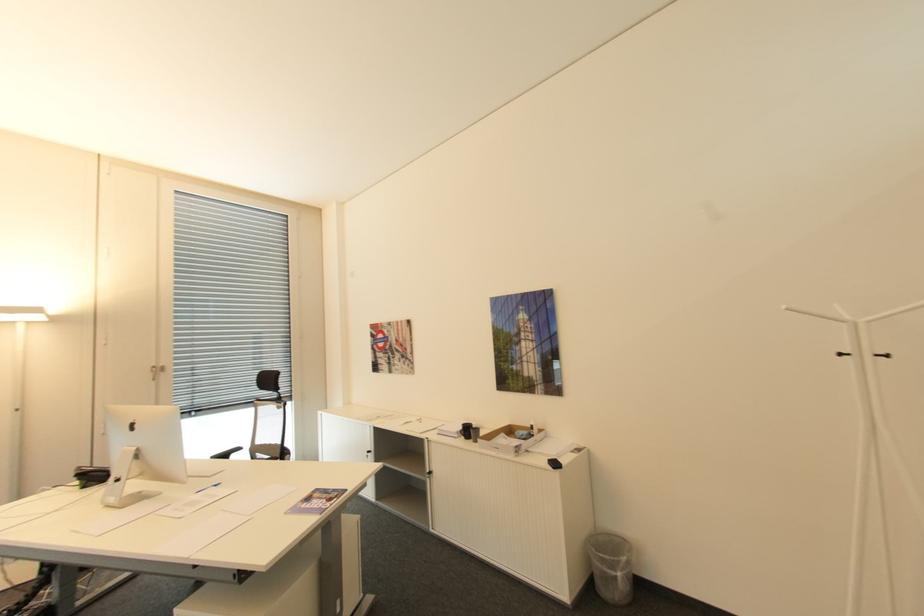
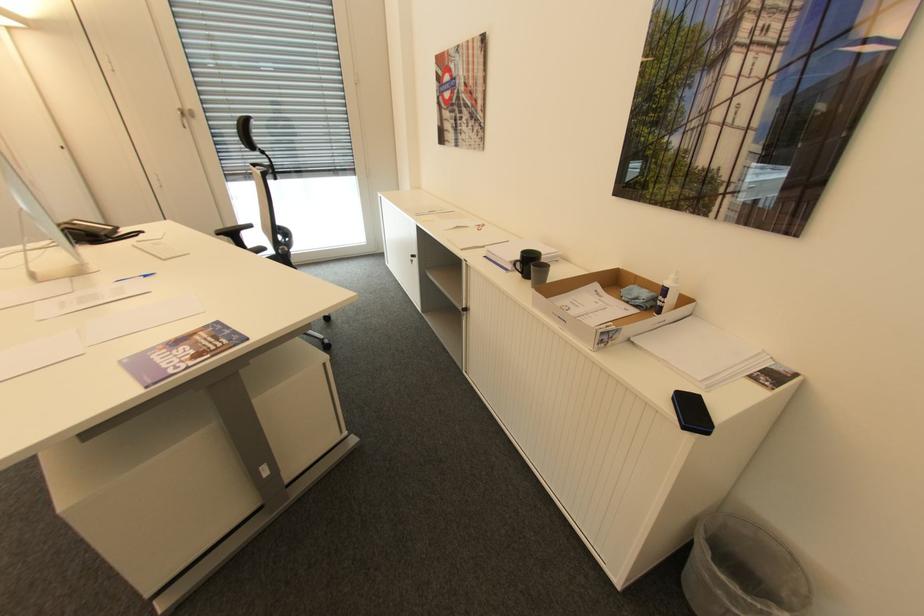
Where in the second image is the point corresponding to pixel 108 474 from the first image?

(88, 233)